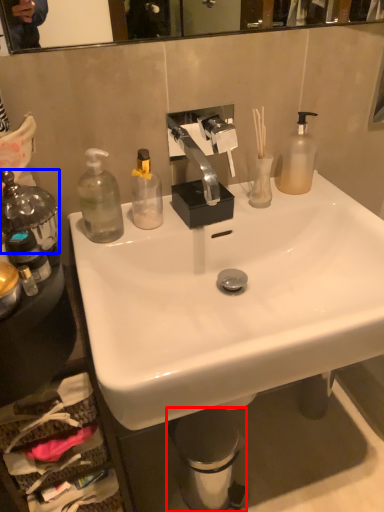
Question: Which object appears farthest to the camera in this image, trash bin/can (highlighted by a red box) or bottle (highlighted by a blue box)?

Choices:
 (A) trash bin/can
 (B) bottle

Answer: (A)